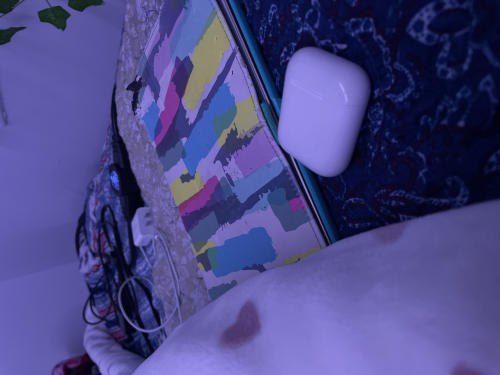
Where is `bed sheet`? bed sheet is located at coordinates (307, 325).